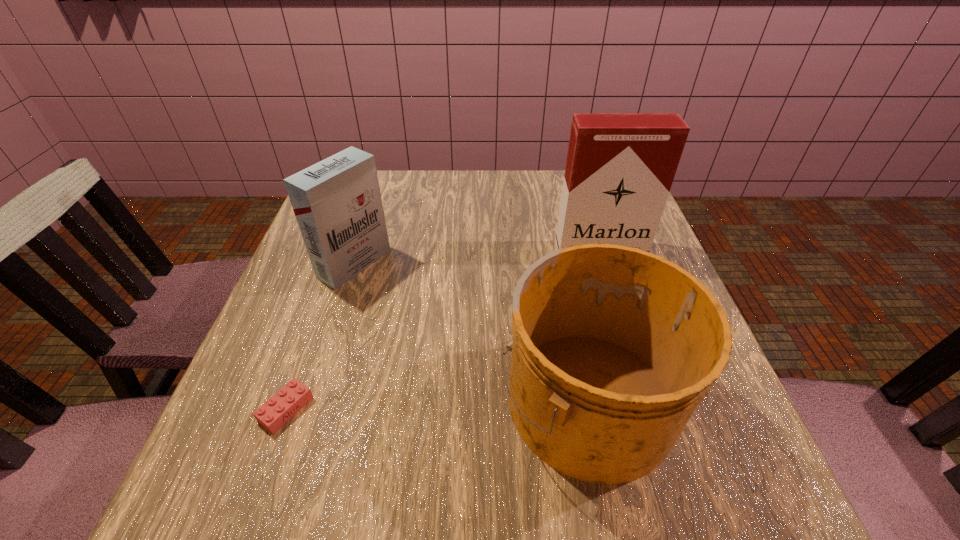
The width and height of the screenshot is (960, 540). What are the coordinates of `vacant space that satisfies the following two spatial constraints: 1. on the front side of the bucket; 2. on the left side of the left cigarette case` in the screenshot? It's located at (312, 398).